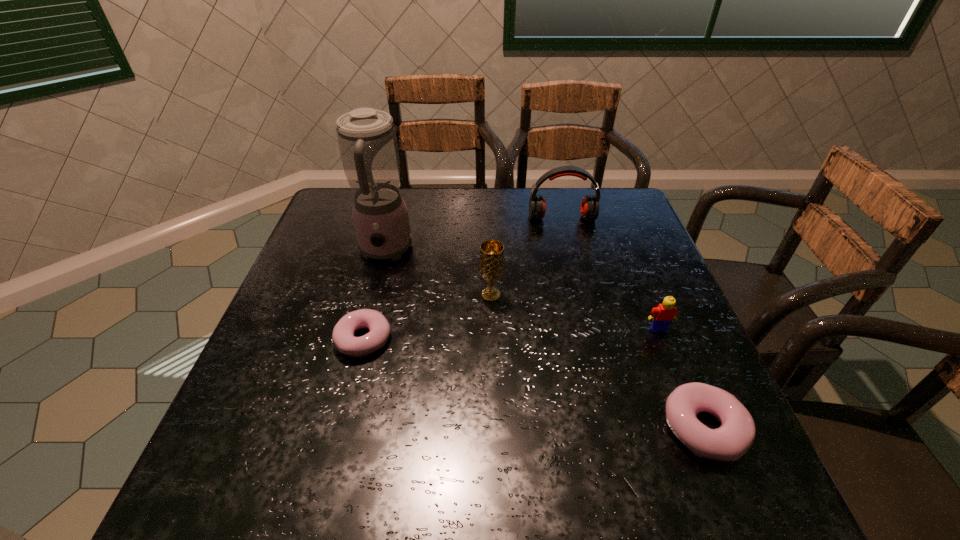
Where is `free location that satisfies the following two spatial constraints: 1. on the ear cups of the nearer doughnut; 2. on the left side of the farthest object`? The height and width of the screenshot is (540, 960). free location that satisfies the following two spatial constraints: 1. on the ear cups of the nearer doughnut; 2. on the left side of the farthest object is located at coordinates [612, 429].

This screenshot has width=960, height=540. I want to click on vacant space that satisfies the following two spatial constraints: 1. on the base of the third object from left to right near the control knob; 2. on the right side of the tallest object, so click(373, 295).